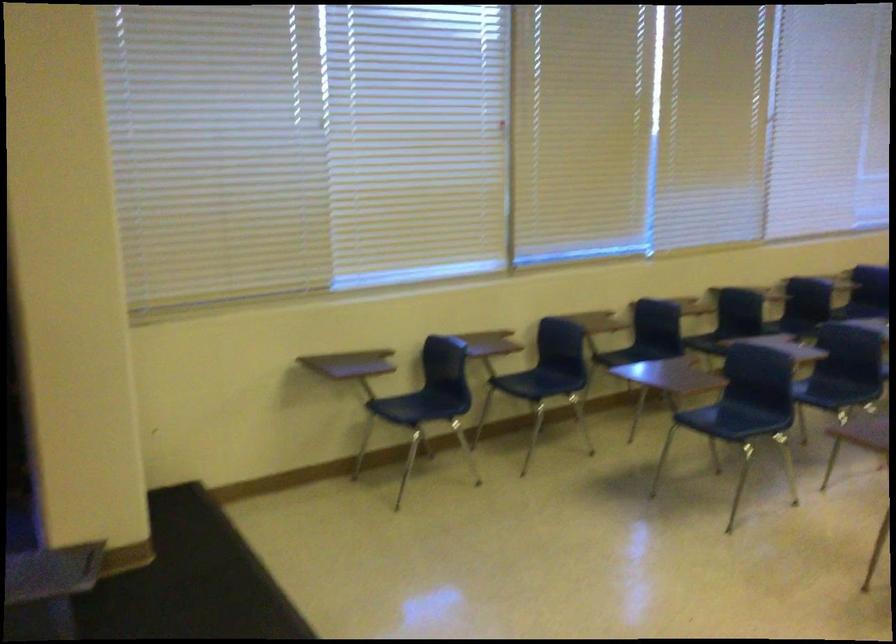
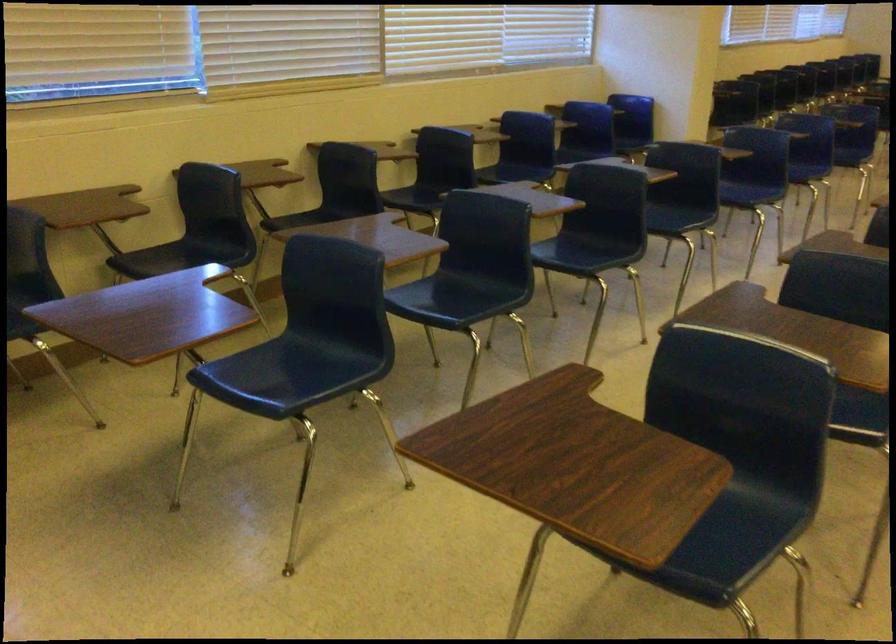
What movement of the cameraman would produce the second image?

The cameraman moved toward right, forward.